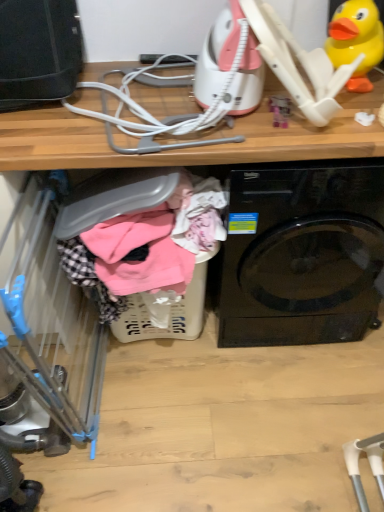
Question: Does plastic laundry basket at lower center have a greater width compared to black glossy washing machine at center?

Choices:
 (A) no
 (B) yes

Answer: (A)

Question: Are plastic laundry basket at lower center and black glossy washing machine at center making contact?

Choices:
 (A) no
 (B) yes

Answer: (A)

Question: From the image's perspective, is plastic laundry basket at lower center above black glossy washing machine at center?

Choices:
 (A) no
 (B) yes

Answer: (A)

Question: Is plastic laundry basket at lower center closer to the viewer compared to black glossy washing machine at center?

Choices:
 (A) yes
 (B) no

Answer: (B)

Question: Does plastic laundry basket at lower center have a larger size compared to black glossy washing machine at center?

Choices:
 (A) no
 (B) yes

Answer: (A)

Question: Is plastic laundry basket at lower center oriented away from black glossy washing machine at center?

Choices:
 (A) no
 (B) yes

Answer: (A)

Question: From a real-world perspective, is black glossy washing machine at center beneath blue plastic baby carriage at left?

Choices:
 (A) no
 (B) yes

Answer: (A)

Question: Is black glossy washing machine at center located outside blue plastic baby carriage at left?

Choices:
 (A) no
 (B) yes

Answer: (B)

Question: Is black glossy washing machine at center further to the viewer compared to blue plastic baby carriage at left?

Choices:
 (A) no
 (B) yes

Answer: (B)

Question: From a real-world perspective, is black glossy washing machine at center located higher than blue plastic baby carriage at left?

Choices:
 (A) yes
 (B) no

Answer: (A)

Question: Is black glossy washing machine at center directly adjacent to blue plastic baby carriage at left?

Choices:
 (A) yes
 (B) no

Answer: (B)

Question: Considering the relative sizes of black glossy washing machine at center and blue plastic baby carriage at left in the image provided, is black glossy washing machine at center bigger than blue plastic baby carriage at left?

Choices:
 (A) yes
 (B) no

Answer: (A)

Question: Are yellow rubber duck at upper right and blue plastic baby carriage at left far apart?

Choices:
 (A) yes
 (B) no

Answer: (A)